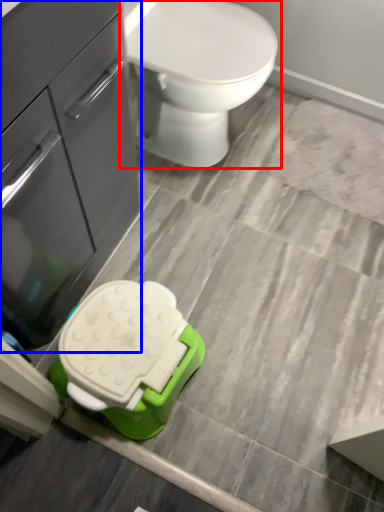
Question: Among these objects, which one is nearest to the camera, toilet (highlighted by a red box) or bathroom cabinet (highlighted by a blue box)?

Choices:
 (A) toilet
 (B) bathroom cabinet

Answer: (B)